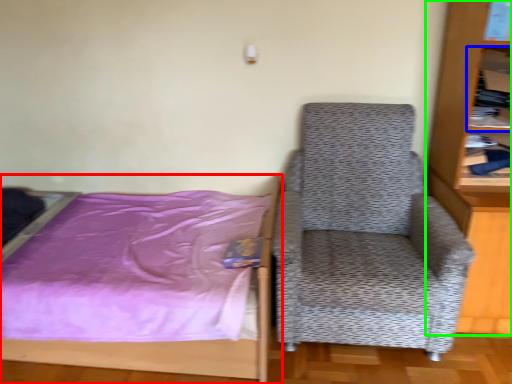
Question: Which is farther away from bed (highlighted by a red box)? shelf (highlighted by a blue box) or bookcase (highlighted by a green box)?

Choices:
 (A) shelf
 (B) bookcase

Answer: (A)